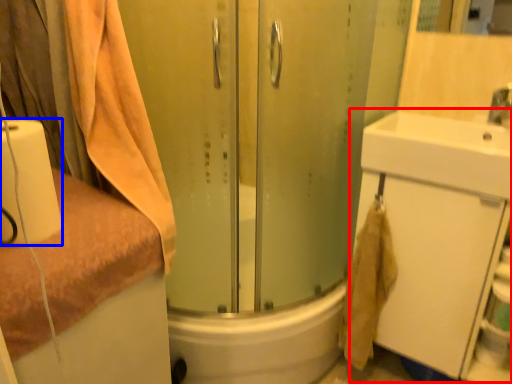
Question: Which of the following is the farthest to the observer, bathroom cabinet (highlighted by a red box) or toilet paper (highlighted by a blue box)?

Choices:
 (A) bathroom cabinet
 (B) toilet paper

Answer: (A)